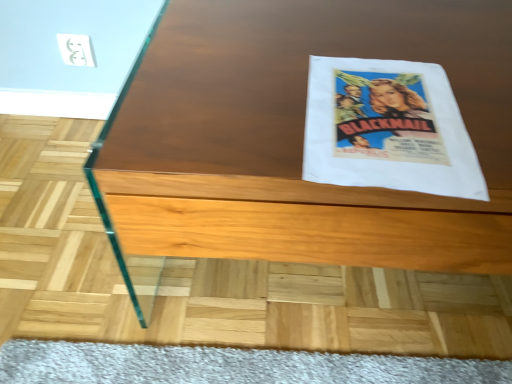
What do you see at coordinates (297, 137) in the screenshot? The image size is (512, 384). I see `wooden table at center` at bounding box center [297, 137].

I want to click on wooden table at center, so click(297, 137).

Measure the distance between white paper flyer at upper right and camera.

white paper flyer at upper right is 19.33 inches away from camera.

You are a GUI agent. You are given a task and a screenshot of the screen. Output one action in this format:
    pyautogui.click(x=<x>, y=<y>)
    Task: Click on the white paper flyer at upper right
    Image resolution: width=512 pixels, height=384 pixels.
    Given the screenshot: What is the action you would take?
    pyautogui.click(x=387, y=128)

What do you see at coordinates (387, 128) in the screenshot? The height and width of the screenshot is (384, 512). I see `white paper flyer at upper right` at bounding box center [387, 128].

At what (x,y) coordinates should I click in order to perform the action: click on wooden table at center. Please return your answer as a coordinate pair (x, y). This screenshot has height=384, width=512. Looking at the image, I should click on (297, 137).

Between white paper flyer at upper right and wooden table at center, which one appears on the left side from the viewer's perspective?

From the viewer's perspective, white paper flyer at upper right appears more on the left side.

Is white paper flyer at upper right positioned before wooden table at center?

That is False.

Which is nearer, (393, 138) or (233, 245)?

Point (393, 138)

From the image's perspective, is white paper flyer at upper right above wooden table at center?

Indeed, from the image's perspective, white paper flyer at upper right is shown above wooden table at center.

From a real-world perspective, is white paper flyer at upper right physically below wooden table at center?

Incorrect, from a real-world perspective, white paper flyer at upper right is higher than wooden table at center.

Looking at their sizes, would you say white paper flyer at upper right is wider or thinner than wooden table at center?

Clearly, white paper flyer at upper right has less width compared to wooden table at center.

Who is taller, white paper flyer at upper right or wooden table at center?

With more height is wooden table at center.

Based on their sizes in the image, would you say white paper flyer at upper right is bigger or smaller than wooden table at center?

white paper flyer at upper right is smaller than wooden table at center.

Would you say white paper flyer at upper right is inside or outside wooden table at center?

white paper flyer at upper right lies within the bounds of wooden table at center.

Is white paper flyer at upper right placed right next to wooden table at center?

No, white paper flyer at upper right is not touching wooden table at center.

Is white paper flyer at upper right facing towards wooden table at center?

Yes, white paper flyer at upper right is aimed at wooden table at center.

Looking at this image, measure the distance from white paper flyer at upper right to wooden table at center.

white paper flyer at upper right and wooden table at center are 4.52 inches apart.

The width and height of the screenshot is (512, 384). Identify the location of flyer that appears above the wooden table at center (from the image's perspective). (387, 128).

Between wooden table at center and white paper flyer at upper right, which one appears on the left side from the viewer's perspective?

Positioned to the left is white paper flyer at upper right.

Which object is more forward, wooden table at center or white paper flyer at upper right?

wooden table at center is closer to the camera.

Considering the points (189, 151) and (483, 196), which point is in front, point (189, 151) or point (483, 196)?

The point (483, 196) is more forward.

From the image's perspective, which one is positioned higher, wooden table at center or white paper flyer at upper right?

From the image's view, white paper flyer at upper right is above.

From a real-world perspective, between wooden table at center and white paper flyer at upper right, who is vertically lower?

wooden table at center is physically lower.

Looking at this image, does wooden table at center have a greater width compared to white paper flyer at upper right?

Yes.

Who is taller, wooden table at center or white paper flyer at upper right?

wooden table at center.

Is wooden table at center bigger or smaller than white paper flyer at upper right?

wooden table at center is bigger than white paper flyer at upper right.

Is wooden table at center inside the boundaries of white paper flyer at upper right, or outside?

wooden table at center cannot be found inside white paper flyer at upper right.

Are wooden table at center and white paper flyer at upper right far apart?

They are positioned close to each other.

Is wooden table at center facing towards white paper flyer at upper right?

No, wooden table at center is not facing towards white paper flyer at upper right.

This screenshot has height=384, width=512. In the image, there is a wooden table at center. Identify the location of flyer above it (from the image's perspective). (387, 128).

Image resolution: width=512 pixels, height=384 pixels. I want to click on flyer above the wooden table at center (from a real-world perspective), so click(387, 128).

Identify the location of table that appears below the white paper flyer at upper right (from the image's perspective). Image resolution: width=512 pixels, height=384 pixels. tap(297, 137).